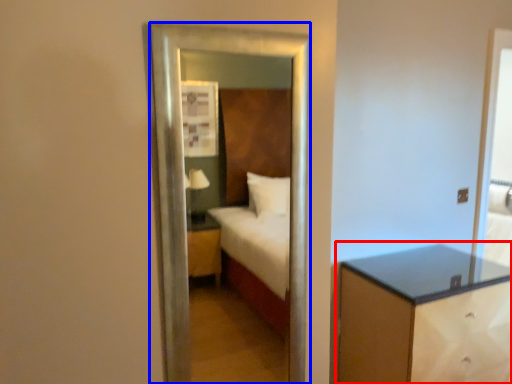
Question: Among these objects, which one is farthest to the camera, nightstand (highlighted by a red box) or mirror (highlighted by a blue box)?

Choices:
 (A) nightstand
 (B) mirror

Answer: (A)